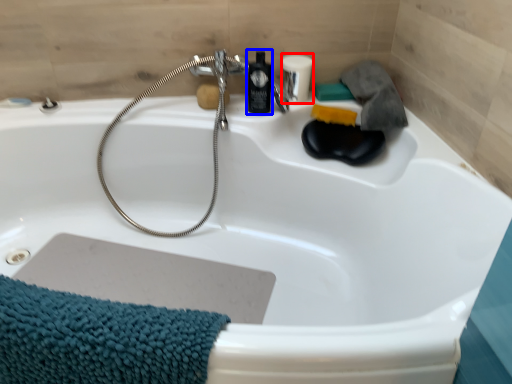
Question: Among these objects, which one is farthest to the camera, toiletry (highlighted by a red box) or mouthwash (highlighted by a blue box)?

Choices:
 (A) toiletry
 (B) mouthwash

Answer: (A)